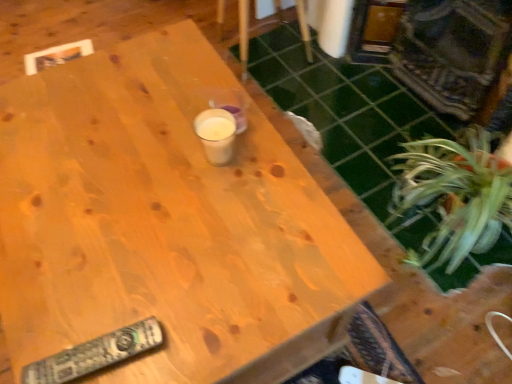
Where is `free spot behind black plastic remote at lower left`? This screenshot has height=384, width=512. free spot behind black plastic remote at lower left is located at coordinates (106, 268).